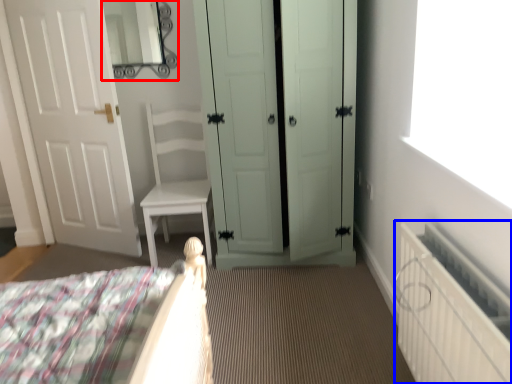
Question: Which object appears closest to the camera in this image, mirror (highlighted by a red box) or radiator (highlighted by a blue box)?

Choices:
 (A) mirror
 (B) radiator

Answer: (B)